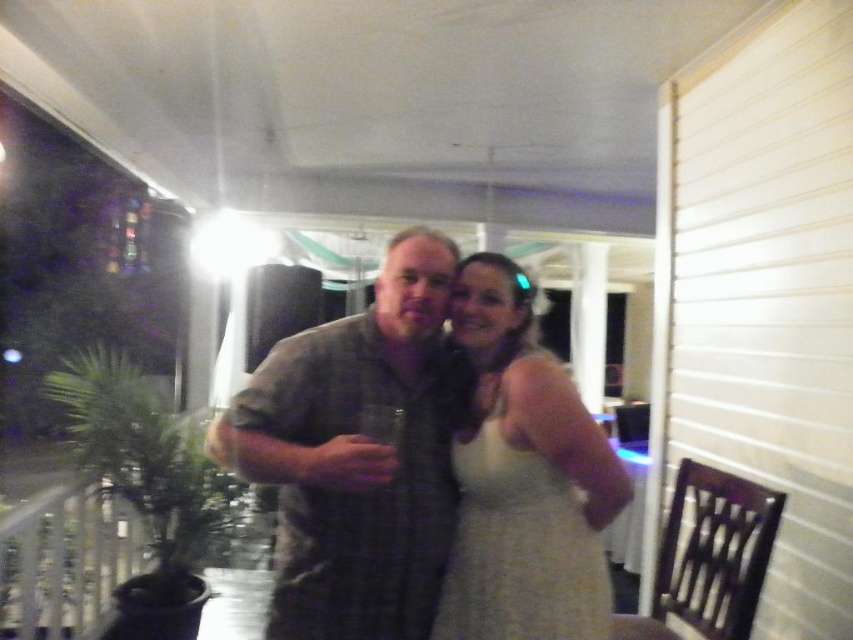
Question: Which object is closer to the camera taking this photo?

Choices:
 (A) gray plaid shirt at center
 (B) white satin dress at center

Answer: (A)

Question: Does gray plaid shirt at center appear under white satin dress at center?

Choices:
 (A) yes
 (B) no

Answer: (B)

Question: Is gray plaid shirt at center to the left of white satin dress at center from the viewer's perspective?

Choices:
 (A) no
 (B) yes

Answer: (B)

Question: Which point is farther to the camera?

Choices:
 (A) (281, 577)
 (B) (476, 497)

Answer: (B)

Question: Can you confirm if gray plaid shirt at center is positioned above white satin dress at center?

Choices:
 (A) no
 (B) yes

Answer: (B)